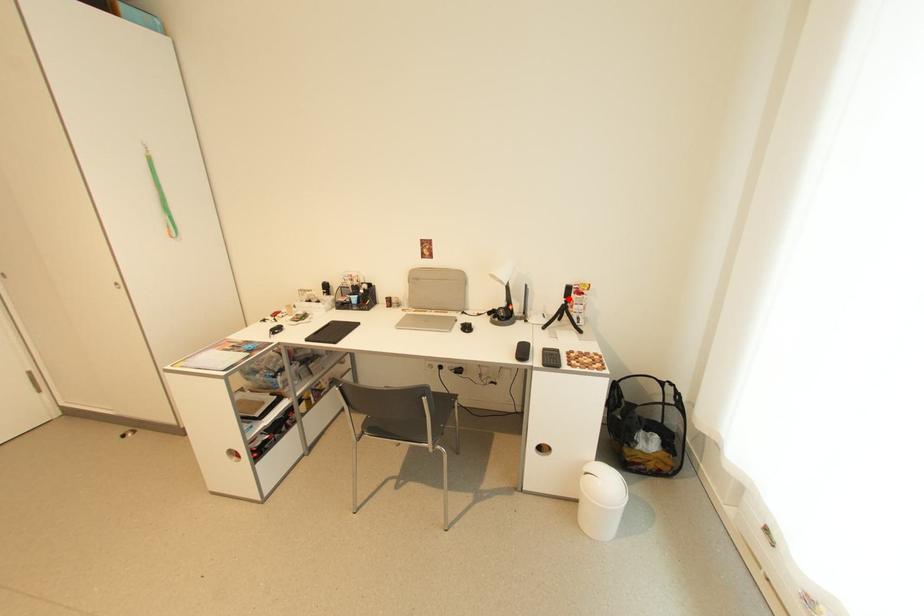
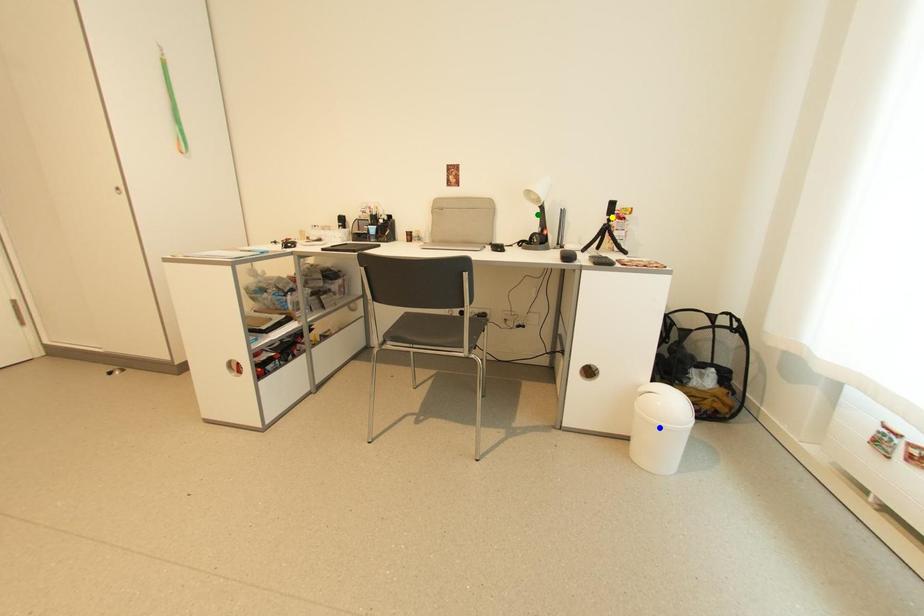
Question: I am providing you with two images of the same scene from different viewpoints. A red point is marked on the first image. You are given multiple points on the second image. Which mark in image 2 goes with the point in image 1?

Choices:
 (A) yellow point
 (B) green point
 (C) blue point

Answer: (A)